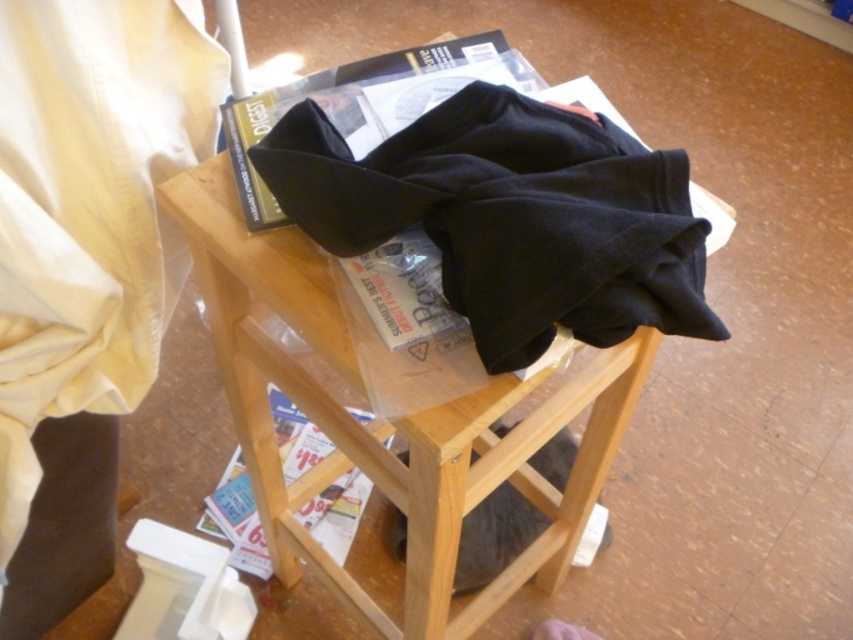
Is wooden stool at center behind printed paper magazine at lower center?

No.

Does wooden stool at center have a lesser width compared to printed paper magazine at lower center?

No.

Which is in front, point (595, 406) or point (289, 481)?

Point (595, 406)

Identify the location of wooden stool at center. The height and width of the screenshot is (640, 853). (387, 422).

Between point (628, 324) and point (457, 442), which one is positioned behind?

Positioned behind is point (457, 442).

Can you confirm if black cotton blanket at center is positioned to the right of wooden stool at center?

Correct, you'll find black cotton blanket at center to the right of wooden stool at center.

Which is in front, point (465, 97) or point (430, 445)?

Positioned in front is point (430, 445).

Where is `black cotton blanket at center`? Image resolution: width=853 pixels, height=640 pixels. black cotton blanket at center is located at coordinates (509, 216).

Is point (444, 404) farther from viewer compared to point (271, 128)?

No, (444, 404) is in front of (271, 128).

Measure the distance between point (262, 486) and camera.

Point (262, 486) and camera are 3.49 feet apart.

Is point (370, 616) closer to camera compared to point (245, 182)?

No, it is behind (245, 182).

This screenshot has height=640, width=853. Find the location of `wooden stool at center`. wooden stool at center is located at coordinates (387, 422).